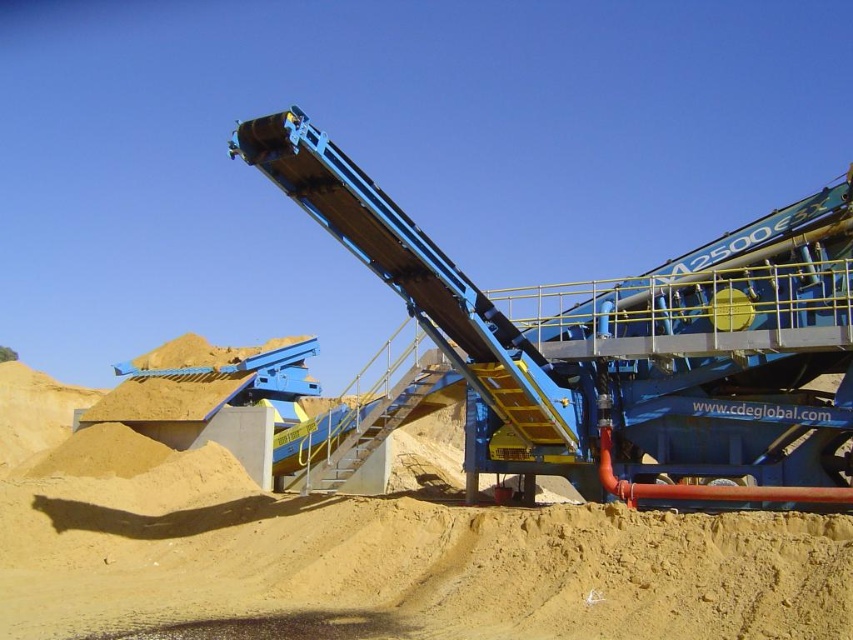
You are an operator standing at the control panel of the conveyor system. You notice both the yellow sand at center and the blue metallic conveyor at center. Which object is located to the left of the other?

The yellow sand at center is positioned on the left side of blue metallic conveyor at center, so the yellow sand at center is to the left of the blue metallic conveyor at center.

You are an engineer inspecting the conveyor system. You notice the yellow sand at center and the blue metallic conveyor at center. Which object is taller?

The blue metallic conveyor at center is taller than the yellow sand at center.